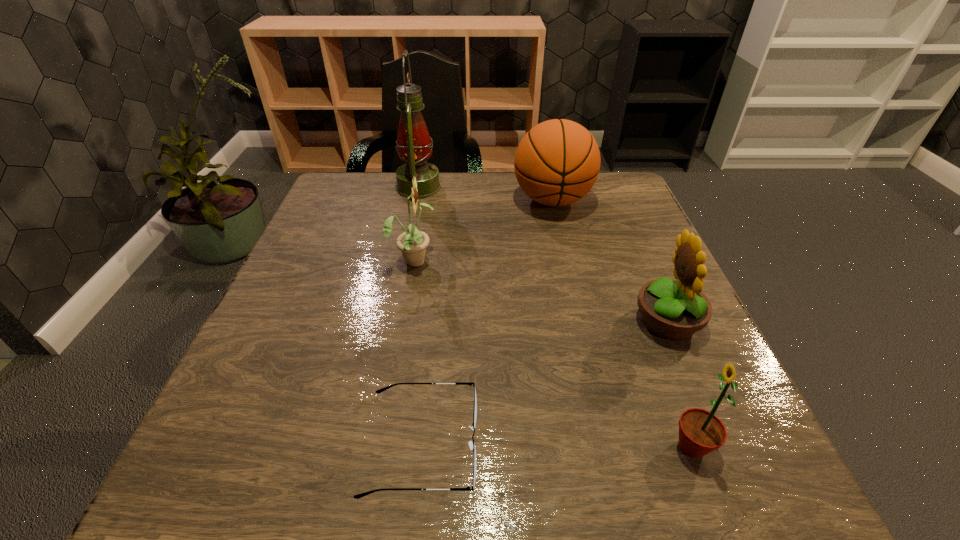
Locate an element on the screen. This screenshot has height=540, width=960. free space located on the face of the second nearest sunflower is located at coordinates (602, 321).

Where is `vacant space positioned on the face of the second nearest sunflower`? vacant space positioned on the face of the second nearest sunflower is located at coordinates (490, 321).

Identify the location of free spot located on the face of the second nearest sunflower. (527, 321).

At what (x,y) coordinates should I click in order to perform the action: click on vacant region located on the face of the nearest sunflower. Please return your answer as a coordinate pair (x, y). Image resolution: width=960 pixels, height=540 pixels. Looking at the image, I should click on (478, 447).

The width and height of the screenshot is (960, 540). Identify the location of vacant space positioned on the face of the nearest sunflower. (519, 447).

The image size is (960, 540). Identify the location of free spot located 0.160m on the face of the nearest sunflower. coord(561,447).

I want to click on vacant area situated on the lenses of the spectacles, so click(x=669, y=445).

Where is `oil lamp at the far edge`? oil lamp at the far edge is located at coordinates (413, 145).

Identify the location of basketball situated at the far edge. (557, 162).

This screenshot has width=960, height=540. Identify the location of sunflower located in the near edge section of the desktop. click(x=700, y=432).